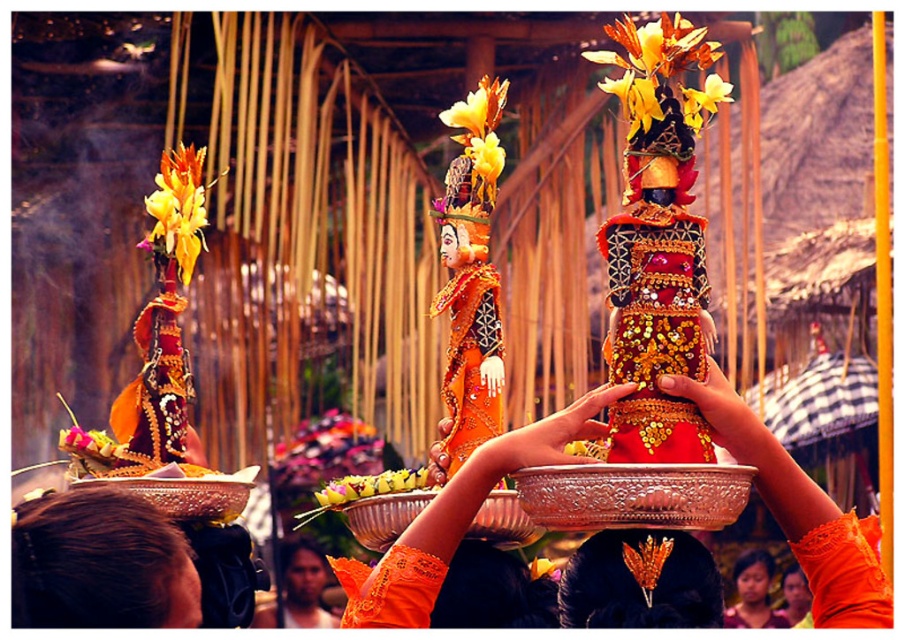
This screenshot has width=905, height=640. Describe the element at coordinates (472, 275) in the screenshot. I see `shiny orange fabric at center` at that location.

Which of these two, shiny orange fabric at center or smooth gold bracelet at center, stands shorter?

smooth gold bracelet at center

At what (x,y) coordinates should I click in order to perform the action: click on shiny orange fabric at center. Please return your answer as a coordinate pair (x, y). Looking at the image, I should click on (472, 275).

You are a GUI agent. You are given a task and a screenshot of the screen. Output one action in this format:
    pyautogui.click(x=<x>, y=<y>)
    Task: Click on the shiny orange fabric at center
    
    Given the screenshot: What is the action you would take?
    pyautogui.click(x=472, y=275)

Does brown hair at center have a greater width compared to yellow matte flower at upper center?

Incorrect, brown hair at center's width does not surpass yellow matte flower at upper center's.

Which is above, brown hair at center or yellow matte flower at upper center?

yellow matte flower at upper center

Which is behind, point (94, 492) or point (684, 92)?

The point (94, 492) is more distant.

Where is `brown hair at center`? brown hair at center is located at coordinates (99, 563).

Is floral garland at center positioned at the back of yellow fabric flower at center?

Yes.

This screenshot has width=905, height=640. What do you see at coordinates (326, 451) in the screenshot?
I see `floral garland at center` at bounding box center [326, 451].

You are a GUI agent. You are given a task and a screenshot of the screen. Output one action in this format:
    pyautogui.click(x=<x>, y=<y>)
    Task: Click on the floral garland at center
    
    Given the screenshot: What is the action you would take?
    pyautogui.click(x=326, y=451)